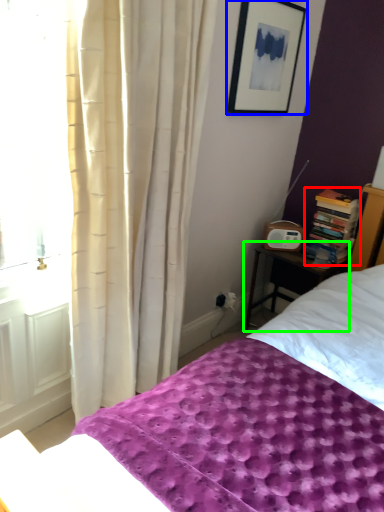
Question: Based on their relative distances, which object is farther from book (highlighted by a red box)? Choose from picture frame (highlighted by a blue box) and nightstand (highlighted by a green box).

Choices:
 (A) picture frame
 (B) nightstand

Answer: (A)